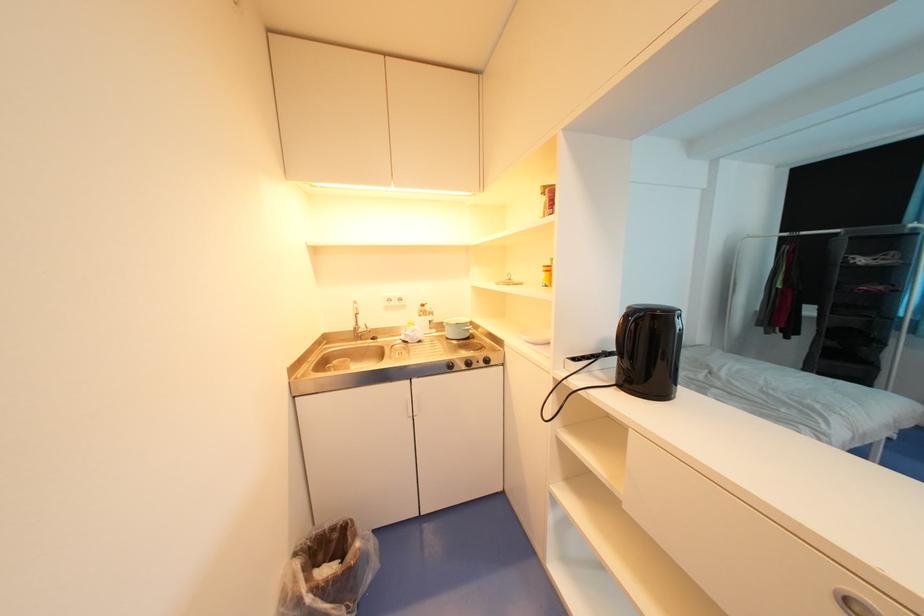
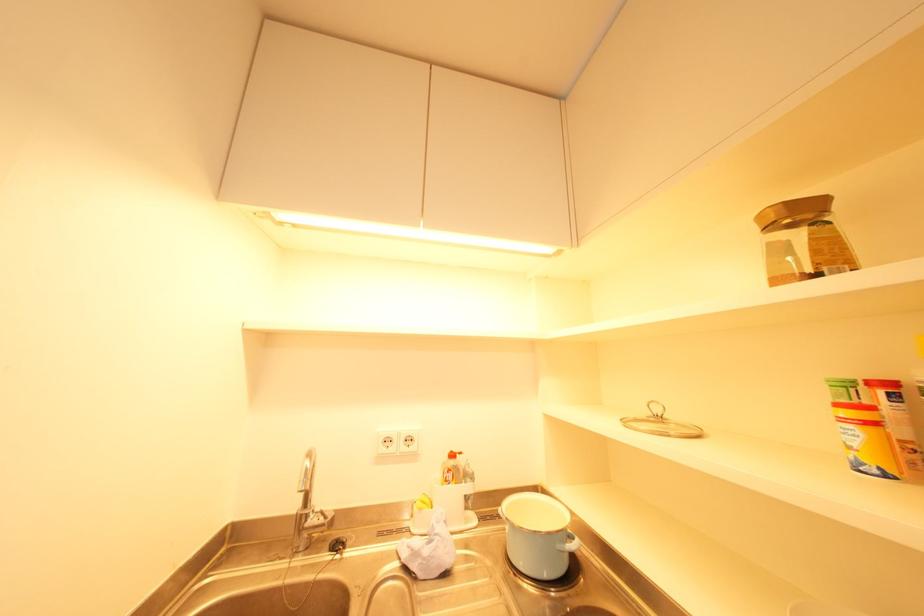
Question: How did the camera likely rotate?

Choices:
 (A) Left
 (B) Right
 (C) Up
 (D) Down

Answer: (C)